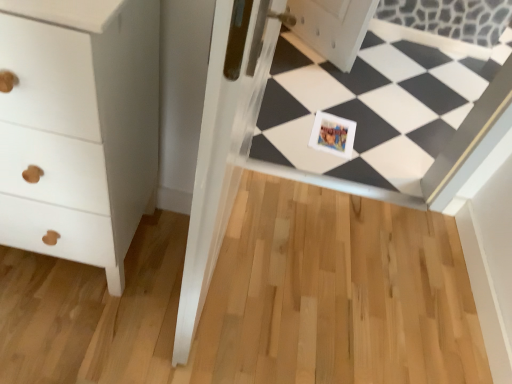
Measure the distance between point (500, 108) and camera.

Point (500, 108) and camera are 4.95 feet apart from each other.

The image size is (512, 384). In order to click on white matte chest of drawers at left in this screenshot , I will do `click(79, 126)`.

Based on the photo, is white glossy frame at center surrounding printed paper postcard at center?

Definitely not — printed paper postcard at center is not inside white glossy frame at center.

Considering the sizes of white glossy frame at center and printed paper postcard at center in the image, is white glossy frame at center taller or shorter than printed paper postcard at center?

Clearly, white glossy frame at center is taller compared to printed paper postcard at center.

Does point (509, 88) come behind point (341, 139)?

No, (509, 88) is in front of (341, 139).

Are white glossy frame at center and white matte chest of drawers at left making contact?

No.

Considering the relative sizes of white glossy frame at center and white matte chest of drawers at left in the image provided, is white glossy frame at center wider than white matte chest of drawers at left?

Incorrect, the width of white glossy frame at center does not surpass that of white matte chest of drawers at left.

Can you tell me how much white glossy frame at center and white matte chest of drawers at left differ in facing direction?

The facing directions of white glossy frame at center and white matte chest of drawers at left are 0.862 degrees apart.

Can you confirm if white glossy frame at center is shorter than white matte chest of drawers at left?

Indeed, white glossy frame at center has a lesser height compared to white matte chest of drawers at left.

Is printed paper postcard at center to the left of white glossy frame at center from the viewer's perspective?

Yes.

I want to click on square above the printed paper postcard at center (from a real-world perspective), so click(x=382, y=110).

From a real-world perspective, who is located lower, printed paper postcard at center or white glossy frame at center?

printed paper postcard at center, from a real-world perspective.

Is point (333, 135) closer to viewer compared to point (74, 191)?

No, it is not.

Are printed paper postcard at center and white matte chest of drawers at left located far from each other?

printed paper postcard at center is far away from white matte chest of drawers at left.

From the image's perspective, which is above, printed paper postcard at center or white matte chest of drawers at left?

printed paper postcard at center, from the image's perspective.

Can you confirm if printed paper postcard at center is wider than white matte chest of drawers at left?

In fact, printed paper postcard at center might be narrower than white matte chest of drawers at left.

From the image's perspective, is white matte chest of drawers at left above or below printed paper postcard at center?

white matte chest of drawers at left is below printed paper postcard at center.

Is white matte chest of drawers at left not near printed paper postcard at center?

white matte chest of drawers at left is far away from printed paper postcard at center.

Which of these two, white matte chest of drawers at left or printed paper postcard at center, is bigger?

white matte chest of drawers at left.

Identify the location of postcard located on the right of white matte chest of drawers at left. Image resolution: width=512 pixels, height=384 pixels. (333, 134).

Is white matte chest of drawers at left far from white glossy frame at center?

Absolutely, white matte chest of drawers at left is distant from white glossy frame at center.

In terms of size, does white matte chest of drawers at left appear bigger or smaller than white glossy frame at center?

In the image, white matte chest of drawers at left appears to be larger than white glossy frame at center.

Based on the photo, which of these two, white matte chest of drawers at left or white glossy frame at center, is wider?

With larger width is white matte chest of drawers at left.

What's the angular difference between white matte chest of drawers at left and white glossy frame at center's facing directions?

The angular difference between white matte chest of drawers at left and white glossy frame at center is 0.862 degrees.

Locate an element on the screen. The height and width of the screenshot is (384, 512). square on the right of printed paper postcard at center is located at coordinates (382, 110).

You are a GUI agent. You are given a task and a screenshot of the screen. Output one action in this format:
    pyautogui.click(x=<x>, y=<y>)
    Task: Click on the square located above the white matte chest of drawers at left (from the image's perspective)
    
    Given the screenshot: What is the action you would take?
    pyautogui.click(x=382, y=110)

Estimate the real-world distances between objects in this image. Which object is further from printed paper postcard at center, white glossy frame at center or white matte chest of drawers at left?

Based on the image, white matte chest of drawers at left appears to be further to printed paper postcard at center.

Which object lies nearer to the anchor point white matte chest of drawers at left, printed paper postcard at center or white glossy frame at center?

Among the two, printed paper postcard at center is located nearer to white matte chest of drawers at left.

When comparing their distances from white matte chest of drawers at left, does white glossy frame at center or printed paper postcard at center seem further?

white glossy frame at center is positioned further to the anchor white matte chest of drawers at left.

Which object lies nearer to the anchor point printed paper postcard at center, white matte chest of drawers at left or white glossy frame at center?

white glossy frame at center.

Based on their spatial positions, is white matte chest of drawers at left or printed paper postcard at center closer to white glossy frame at center?

printed paper postcard at center lies closer to white glossy frame at center than the other object.

When comparing their distances from white glossy frame at center, does printed paper postcard at center or white matte chest of drawers at left seem closer?

printed paper postcard at center lies closer to white glossy frame at center than the other object.

I want to click on square located between white matte chest of drawers at left and printed paper postcard at center in the depth direction, so click(382, 110).